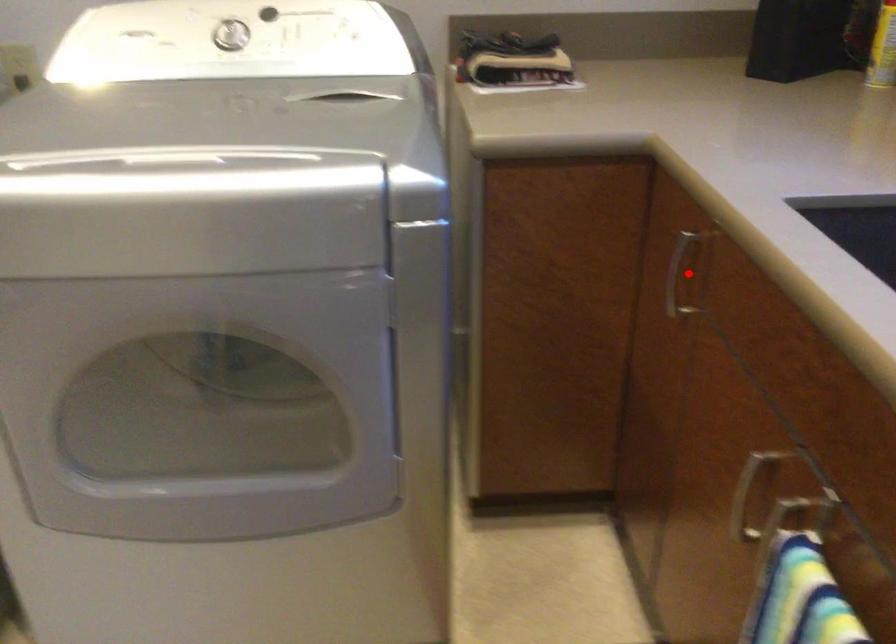
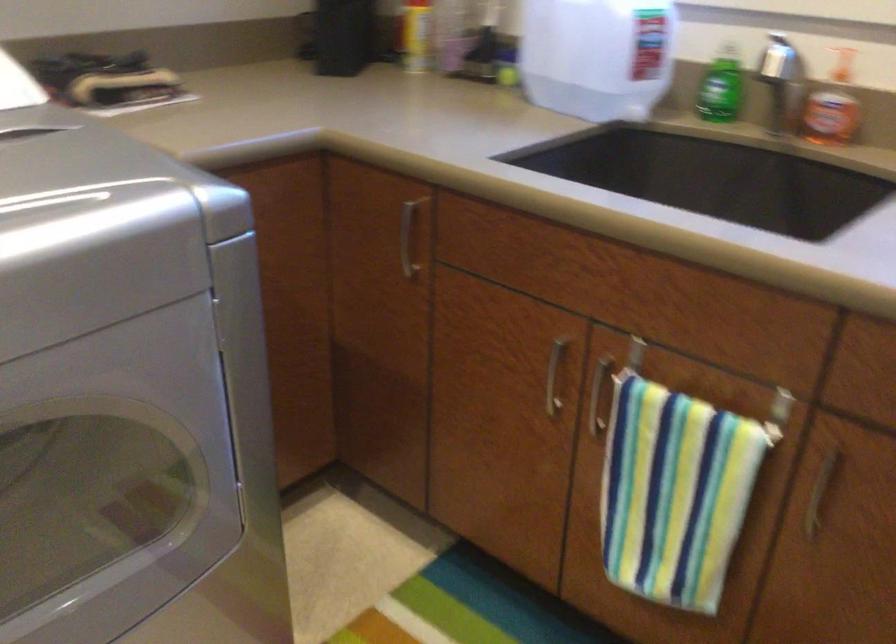
Locate, in the second image, the point that corresponds to the highlighted location in the first image.

(407, 238)